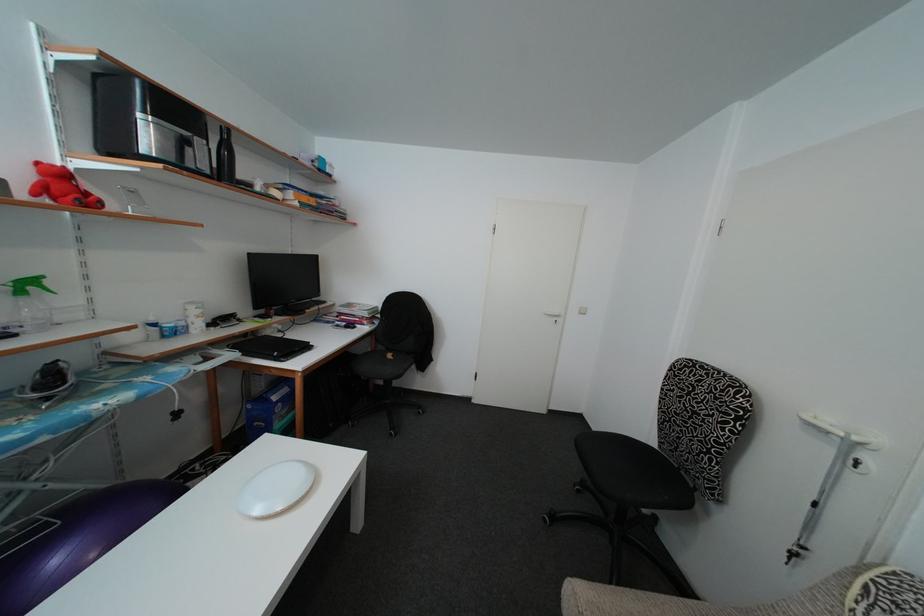
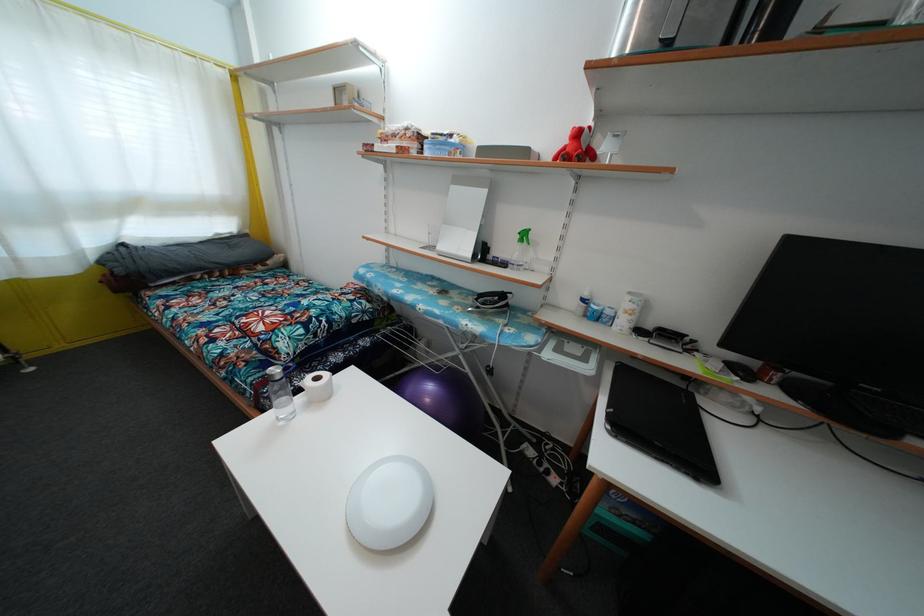
In the second image, find the point that corresponds to pixel 213 328 in the first image.

(652, 334)